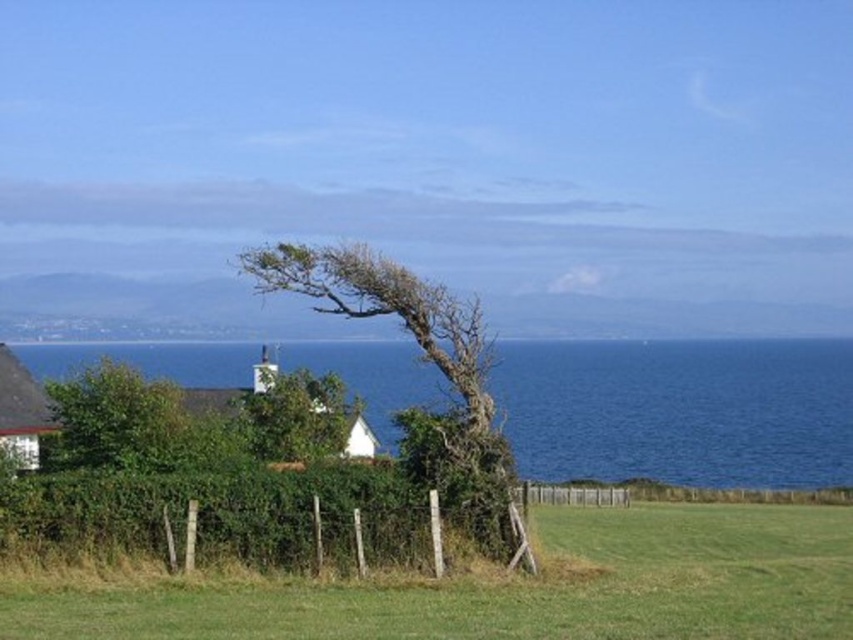
In the scene shown: Is blue water at center in front of green leafy tree at center?

Yes, it is.

The width and height of the screenshot is (853, 640). Identify the location of blue water at center. (680, 410).

Does point (833, 340) lie behind point (341, 412)?

Yes.

I want to click on blue water at center, so click(x=680, y=410).

Between green grass at lower center and green leafy tree at lower left, which one has more height?

Standing taller between the two is green grass at lower center.

Is green grass at lower center taller than green leafy tree at lower left?

Correct, green grass at lower center is much taller as green leafy tree at lower left.

Is point (550, 612) less distant than point (74, 396)?

Yes, point (550, 612) is closer to viewer.

Locate an element on the screen. The height and width of the screenshot is (640, 853). green grass at lower center is located at coordinates (514, 588).

Does green grass at lower center have a greater height compared to green leafy tree at center?

Correct, green grass at lower center is much taller as green leafy tree at center.

In the scene shown: Which is more to the left, green grass at lower center or green leafy tree at center?

green leafy tree at center

Which is behind, point (329, 582) or point (283, 428)?

Positioned behind is point (283, 428).

Identify the location of green grass at lower center. (514, 588).